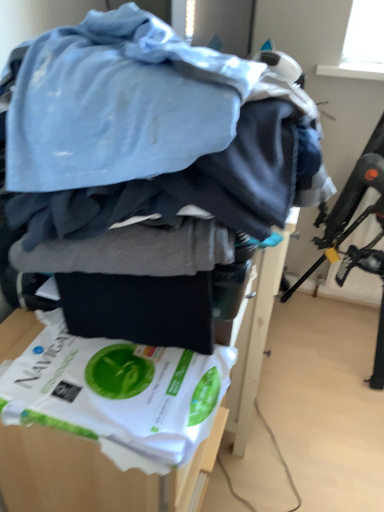
Question: Considering the positions of white paper bag at center and white paper at lower left in the image, is white paper bag at center taller or shorter than white paper at lower left?

Choices:
 (A) tall
 (B) short

Answer: (A)

Question: Visually, is white paper bag at center positioned to the left or to the right of white paper at lower left?

Choices:
 (A) left
 (B) right

Answer: (A)

Question: Which object is positioned closest to the white paper at lower left?

Choices:
 (A) white paper bag at center
 (B) black plastic swivel chair at upper right

Answer: (A)

Question: Which of these objects is positioned closest to the white paper bag at center?

Choices:
 (A) white paper at lower left
 (B) black plastic swivel chair at upper right

Answer: (A)